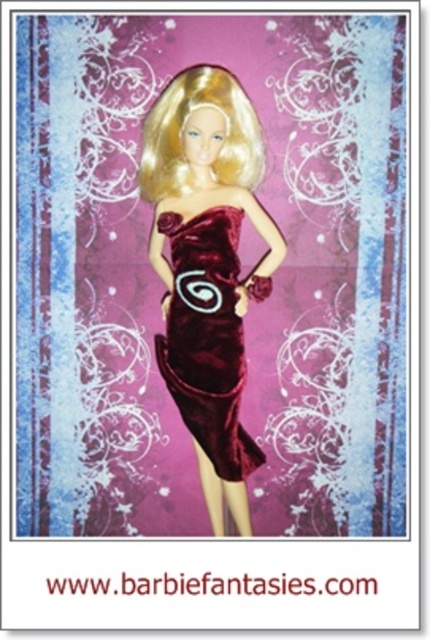
You are an artist trying to paint this doll. You need to know which dress is taller between the velvet dress at center and the velvet burgundy dress at center. Can you tell me?

The velvet dress at center is much taller than the velvet burgundy dress at center according to the description.